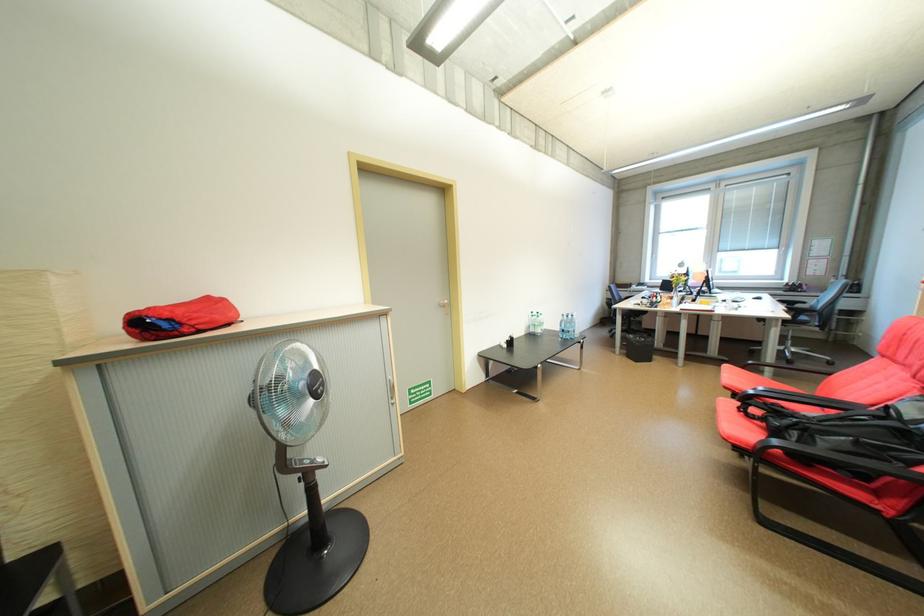
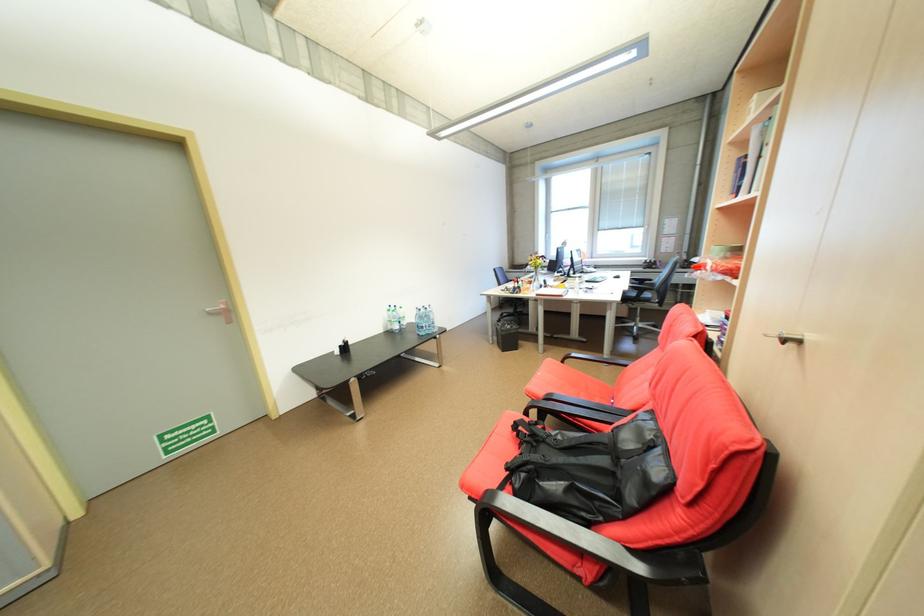
The point at (x=809, y=458) is marked in the first image. Where is the corresponding point in the second image?

(529, 511)